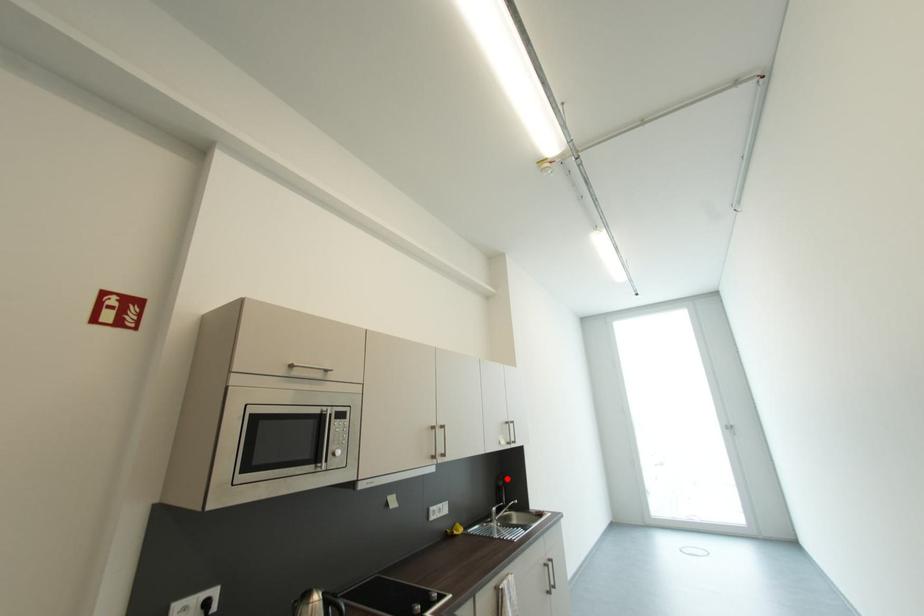
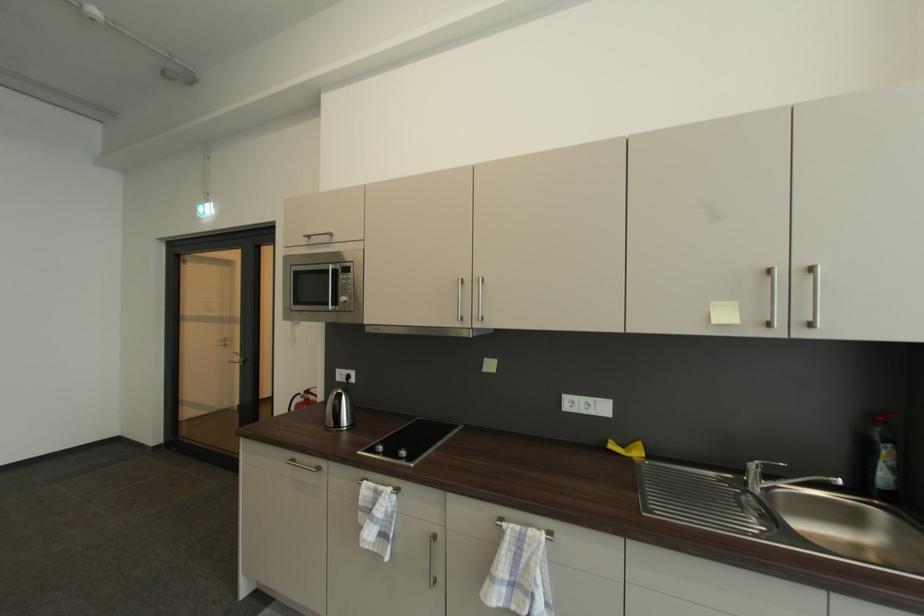
Locate, in the second image, the point that corresponds to the highlighted location in the first image.

(885, 419)